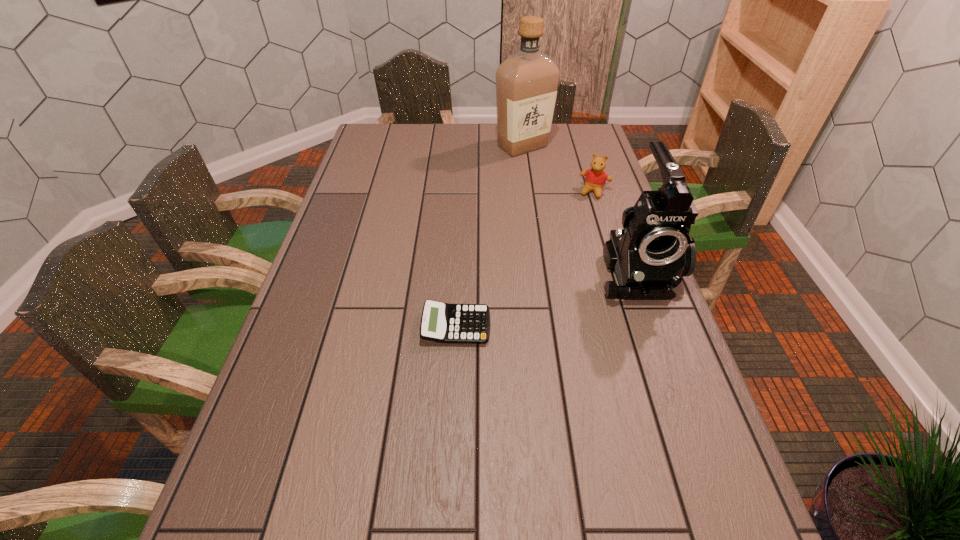
Locate an element on the screen. The height and width of the screenshot is (540, 960). free space that is in between the third farthest object and the tallest object is located at coordinates (580, 208).

At what (x,y) coordinates should I click in order to perform the action: click on free spot between the second shortest object and the tallest object. Please return your answer as a coordinate pair (x, y). The image size is (960, 540). Looking at the image, I should click on (559, 169).

Where is `unoccupied position between the nearest object and the teddy bear`? Image resolution: width=960 pixels, height=540 pixels. unoccupied position between the nearest object and the teddy bear is located at coordinates (525, 259).

Point out which object is positioned as the nearest to the third shortest object. Please provide its 2D coordinates. Your answer should be formatted as a tuple, i.e. [(x, y)], where the tuple contains the x and y coordinates of a point satisfying the conditions above.

[(595, 179)]

Identify which object is the second closest to the teddy bear. Please provide its 2D coordinates. Your answer should be formatted as a tuple, i.e. [(x, y)], where the tuple contains the x and y coordinates of a point satisfying the conditions above.

[(649, 256)]